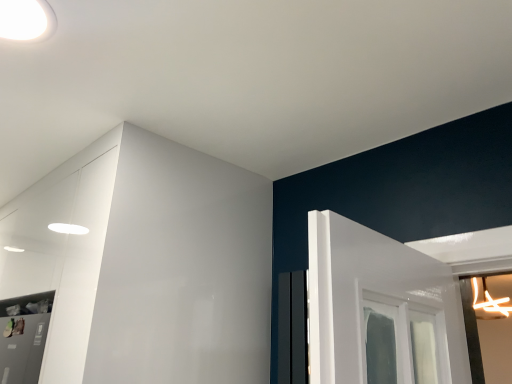
This screenshot has width=512, height=384. Describe the element at coordinates (26, 20) in the screenshot. I see `white glossy light fixture at upper left` at that location.

This screenshot has width=512, height=384. Find the location of `white glossy light fixture at upper left`. white glossy light fixture at upper left is located at coordinates (26, 20).

What do you see at coordinates (146, 264) in the screenshot?
I see `white glossy dresser at upper left` at bounding box center [146, 264].

Identify the location of white glossy dresser at upper left. pyautogui.click(x=146, y=264).

The height and width of the screenshot is (384, 512). What are the coordinates of `white glossy light fixture at upper left` in the screenshot? It's located at (26, 20).

In the scene shown: Which object is positioned more to the left, white glossy light fixture at upper left or white glossy dresser at upper left?

white glossy dresser at upper left.

Is white glossy light fixture at upper left positioned in front of white glossy dresser at upper left?

That is True.

Between point (41, 17) and point (215, 342), which one is positioned behind?

Point (215, 342)

From the image's perspective, does white glossy light fixture at upper left appear higher than white glossy dresser at upper left?

Yes, from the image's perspective, white glossy light fixture at upper left is on top of white glossy dresser at upper left.

Consider the image. From a real-world perspective, which object rests below the other?

From a 3D spatial view, white glossy dresser at upper left is below.

Is white glossy light fixture at upper left thinner than white glossy dresser at upper left?

Yes.

Considering the sizes of white glossy light fixture at upper left and white glossy dresser at upper left in the image, is white glossy light fixture at upper left taller or shorter than white glossy dresser at upper left?

Considering their sizes, white glossy light fixture at upper left has less height than white glossy dresser at upper left.

Who is bigger, white glossy light fixture at upper left or white glossy dresser at upper left?

white glossy dresser at upper left.

Is white glossy light fixture at upper left surrounding white glossy dresser at upper left?

No, white glossy dresser at upper left is not a part of white glossy light fixture at upper left.

Is the surface of white glossy light fixture at upper left in direct contact with white glossy dresser at upper left?

No, white glossy light fixture at upper left is not next to white glossy dresser at upper left.

Could you tell me if white glossy light fixture at upper left is turned towards white glossy dresser at upper left?

No, white glossy light fixture at upper left is not facing towards white glossy dresser at upper left.

This screenshot has height=384, width=512. Find the location of `dresser that is on the left side of white glossy light fixture at upper left`. dresser that is on the left side of white glossy light fixture at upper left is located at coordinates (146, 264).

Between white glossy dresser at upper left and white glossy light fixture at upper left, which one appears on the right side from the viewer's perspective?

white glossy light fixture at upper left is more to the right.

Consider the image. Is white glossy dresser at upper left positioned before white glossy light fixture at upper left?

No, white glossy dresser at upper left is behind white glossy light fixture at upper left.

Is point (134, 163) in front of point (7, 5)?

That is False.

From the image's perspective, between white glossy dresser at upper left and white glossy light fixture at upper left, which one is located above?

white glossy light fixture at upper left, from the image's perspective.

From a real-world perspective, which object stands above the other?

white glossy light fixture at upper left, from a real-world perspective.

Considering the sizes of objects white glossy dresser at upper left and white glossy light fixture at upper left in the image provided, who is thinner, white glossy dresser at upper left or white glossy light fixture at upper left?

white glossy light fixture at upper left.

Considering the sizes of objects white glossy dresser at upper left and white glossy light fixture at upper left in the image provided, who is taller, white glossy dresser at upper left or white glossy light fixture at upper left?

white glossy dresser at upper left is taller.

Looking at the image, does white glossy dresser at upper left seem bigger or smaller compared to white glossy light fixture at upper left?

Considering their sizes, white glossy dresser at upper left takes up more space than white glossy light fixture at upper left.

Choose the correct answer: Is white glossy dresser at upper left inside white glossy light fixture at upper left or outside it?

white glossy dresser at upper left exists outside the volume of white glossy light fixture at upper left.

Is white glossy dresser at upper left beside white glossy light fixture at upper left?

white glossy dresser at upper left is not next to white glossy light fixture at upper left, and they're not touching.

Is white glossy dresser at upper left aimed at white glossy light fixture at upper left?

No, white glossy dresser at upper left is not oriented towards white glossy light fixture at upper left.

How many degrees apart are the facing directions of white glossy dresser at upper left and white glossy light fixture at upper left?

89.9 degrees separate the facing orientations of white glossy dresser at upper left and white glossy light fixture at upper left.

I want to click on light on the right of white glossy dresser at upper left, so click(26, 20).

At what (x,y) coordinates should I click in order to perform the action: click on dresser that appears below the white glossy light fixture at upper left (from the image's perspective). Please return your answer as a coordinate pair (x, y). Looking at the image, I should click on (146, 264).

This screenshot has height=384, width=512. Identify the location of dresser that is on the left side of white glossy light fixture at upper left. (146, 264).